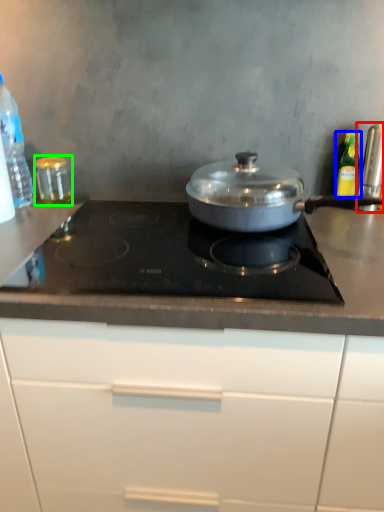
Question: Based on their relative distances, which object is farther from kitchen appliance (highlighted by a red box)? Choose from kitchen appliance (highlighted by a blue box) and kitchen appliance (highlighted by a green box).

Choices:
 (A) kitchen appliance
 (B) kitchen appliance

Answer: (B)